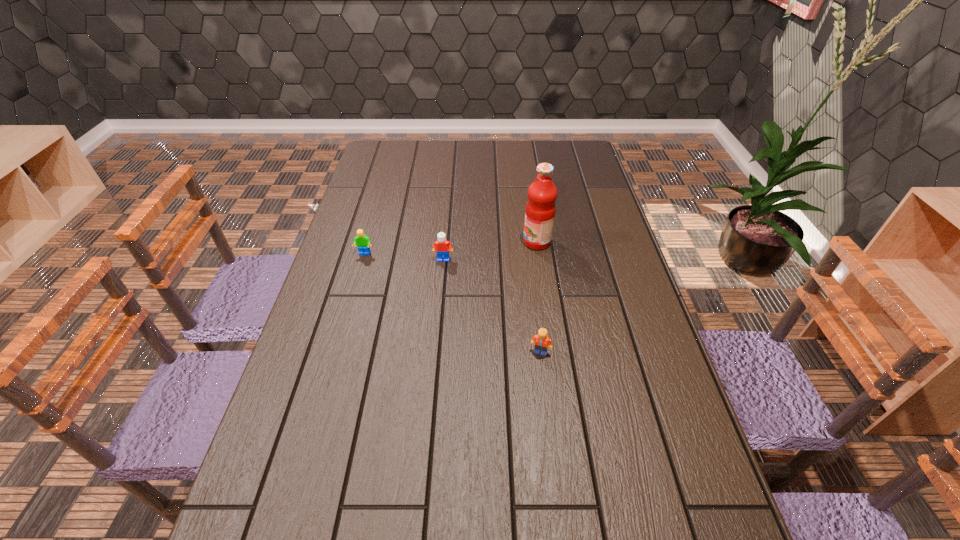
At what (x,y) coordinates should I click in order to perform the action: click on vacant space located 0.230m on the front-facing side of the nearest object. Please return your answer as a coordinate pair (x, y). The image size is (960, 540). Looking at the image, I should click on (552, 447).

I want to click on object at the left edge, so click(362, 241).

The width and height of the screenshot is (960, 540). What are the coordinates of `free space at the far edge` in the screenshot? It's located at (487, 152).

At what (x,y) coordinates should I click in order to perform the action: click on vacant region at the left edge of the desktop. Please return your answer as a coordinate pair (x, y). The width and height of the screenshot is (960, 540). Looking at the image, I should click on (333, 384).

Where is `free space at the right edge of the desktop`? The width and height of the screenshot is (960, 540). free space at the right edge of the desktop is located at coordinates (559, 184).

Where is `vacant area at the far left corner of the desktop`? vacant area at the far left corner of the desktop is located at coordinates (372, 153).

Where is `unoccupied area between the fruit juice and the rightmost Lego`? The image size is (960, 540). unoccupied area between the fruit juice and the rightmost Lego is located at coordinates (539, 297).

Where is `free space between the tallest object and the nearest object`? free space between the tallest object and the nearest object is located at coordinates (539, 297).

The width and height of the screenshot is (960, 540). I want to click on free point between the second Lego from left to right and the fruit juice, so click(x=491, y=251).

Locate an element on the screen. free space between the leftmost Lego and the nearest Lego is located at coordinates (452, 303).